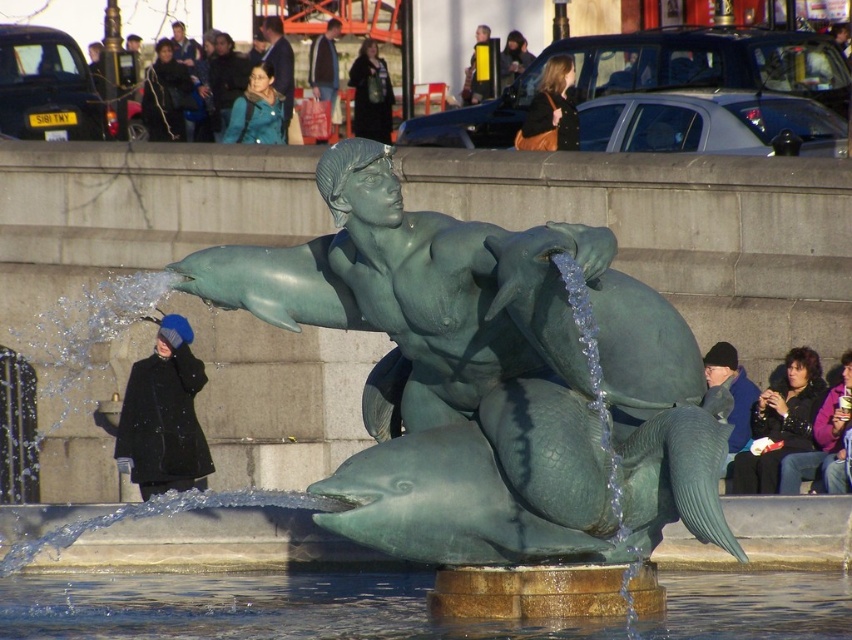
Can you confirm if blue woolen hat at upper left is shorter than dark blue knit cap at upper center?

Yes, blue woolen hat at upper left is shorter than dark blue knit cap at upper center.

Is point (246, 122) farther from camera compared to point (279, 52)?

No, (246, 122) is in front of (279, 52).

What are the coordinates of `blue woolen hat at upper left` in the screenshot? It's located at click(x=257, y=109).

Locate an element on the screen. The image size is (852, 640). blue woolen hat at upper left is located at coordinates (257, 109).

Does green patina statue at center appear on the right side of matte brown purse at upper center?

Incorrect, green patina statue at center is not on the right side of matte brown purse at upper center.

Locate an element on the screen. The width and height of the screenshot is (852, 640). green patina statue at center is located at coordinates (487, 378).

Does black wool coat at left appear on the right side of black fabric jacket at lower right?

Incorrect, black wool coat at left is not on the right side of black fabric jacket at lower right.

Can you confirm if black wool coat at left is thinner than black fabric jacket at lower right?

Incorrect, black wool coat at left's width is not less than black fabric jacket at lower right's.

The height and width of the screenshot is (640, 852). I want to click on black wool coat at left, so click(x=163, y=416).

In order to click on black wool coat at left in this screenshot , I will do `click(163, 416)`.